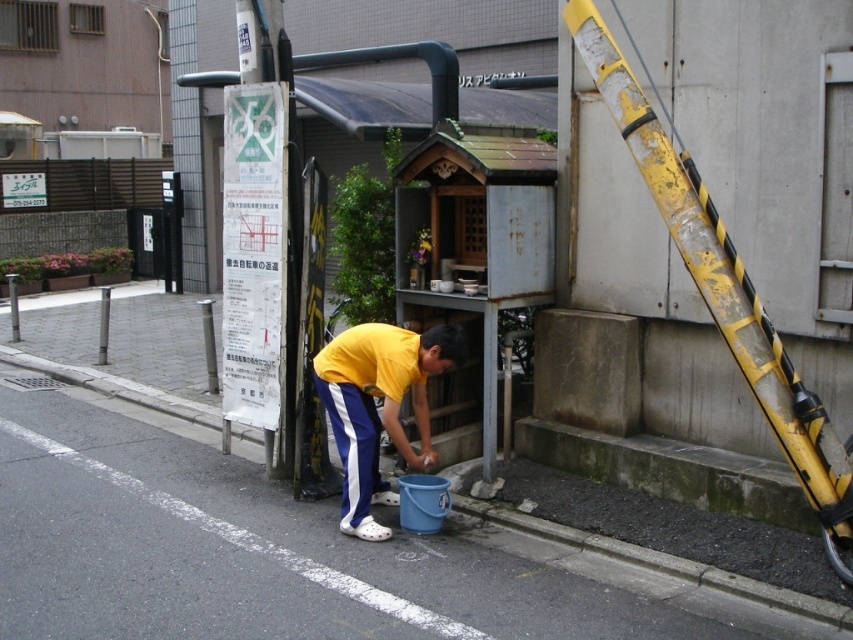
You are a delivery person who needs to place a package on the ground near the blue plastic bucket at lower center. According to the coordinates provided, where should you place the package to ensure it is closest to the bucket?

The blue plastic bucket at lower center is located at point (285, 552), so you should place the package near those coordinates to ensure it is closest to the bucket.